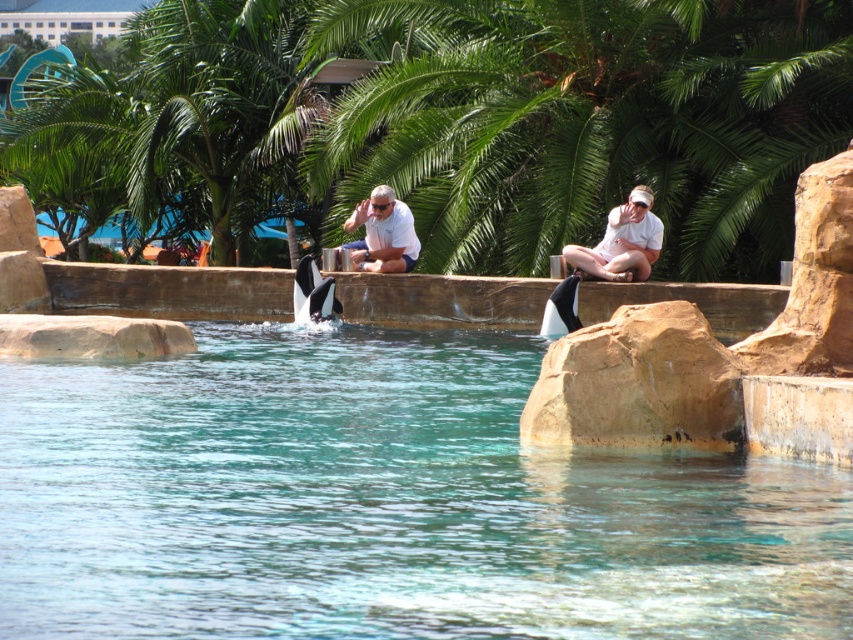
Question: Which of the following is the farthest from the observer?

Choices:
 (A) (218, 616)
 (B) (648, 368)

Answer: (B)

Question: Which of the following is the closest to the observer?

Choices:
 (A) clear blue water at center
 (B) white matte shirt at center

Answer: (A)

Question: Does matte white skin at upper center have a greater width compared to white matte shirt at center?

Choices:
 (A) yes
 (B) no

Answer: (A)

Question: Which object is positioned closest to the white matte clothing at center?

Choices:
 (A) brown rough rock at center
 (B) matte white skin at upper center

Answer: (B)

Question: Is clear blue water at center bigger than white matte clothing at center?

Choices:
 (A) yes
 (B) no

Answer: (A)

Question: Does clear blue water at center have a larger size compared to brown rough rock at center?

Choices:
 (A) yes
 (B) no

Answer: (A)